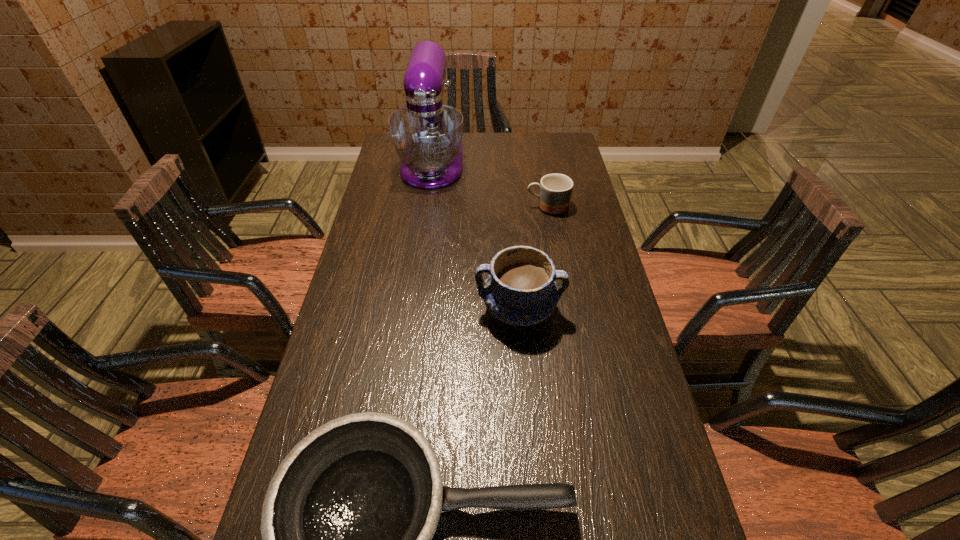
This screenshot has height=540, width=960. I want to click on the tallest object, so click(x=427, y=135).

This screenshot has width=960, height=540. Identify the location of mixer. (427, 135).

Locate an element on the screen. the third farthest object is located at coordinates (520, 290).

Locate an element on the screen. pottery is located at coordinates (520, 290).

The height and width of the screenshot is (540, 960). I want to click on the second shortest object, so click(x=555, y=189).

Where is `mug`? The height and width of the screenshot is (540, 960). mug is located at coordinates (555, 189).

Identify the location of vacant space located at the bowl opening of the tallest object. (426, 208).

Find the location of a particular element. This screenshot has width=960, height=540. vacant space situated 0.080m on the front of the pottery is located at coordinates [523, 368].

Where is `blank area located on the side with the handle of the mug`? blank area located on the side with the handle of the mug is located at coordinates click(454, 207).

Where is `free location located 0.150m on the side with the handle of the mug`? The height and width of the screenshot is (540, 960). free location located 0.150m on the side with the handle of the mug is located at coordinates (481, 207).